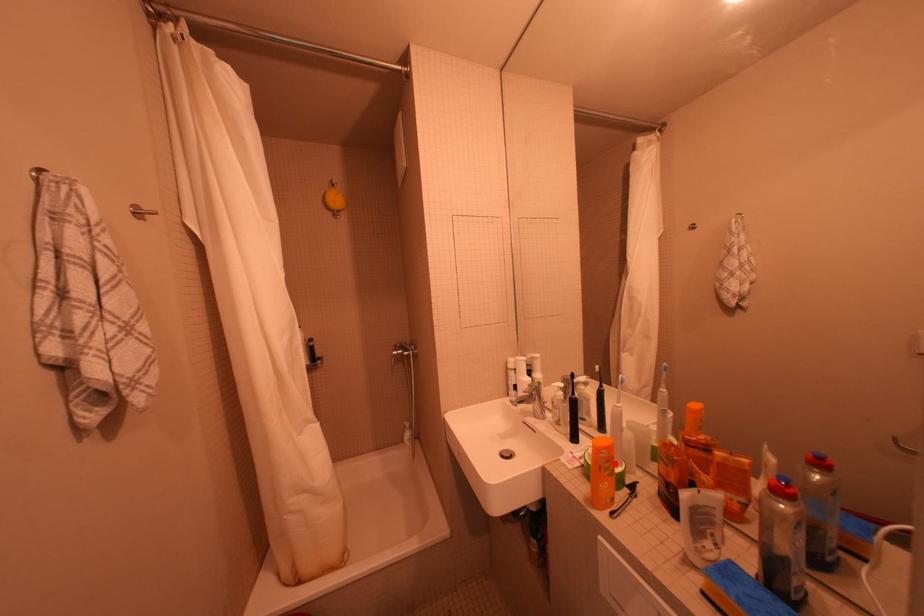
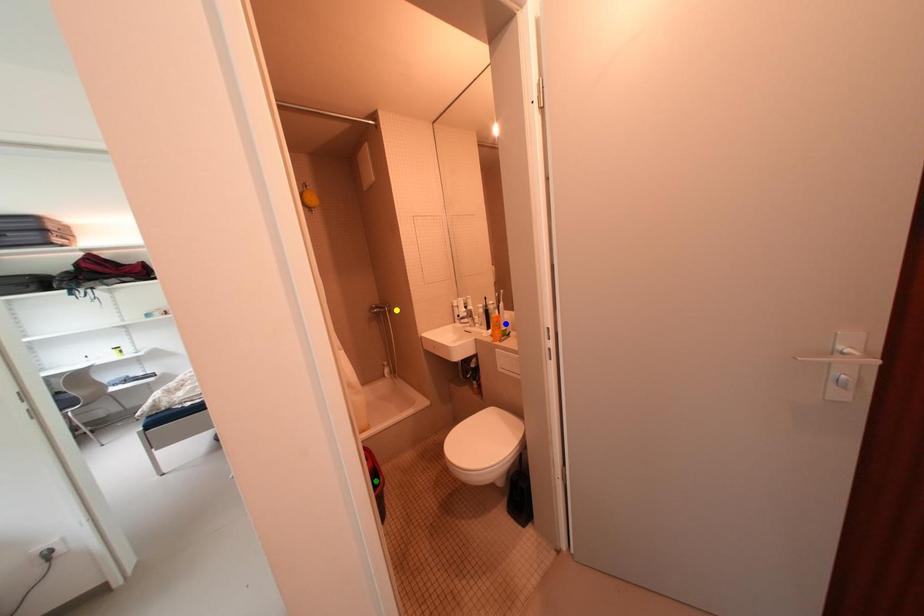
Question: I am providing you with two images of the same scene from different viewpoints. A red point is marked on the first image. You are given multiple points on the second image. Which point in image 2 represents the same 3d spot as the red point in image 1?

Choices:
 (A) blue point
 (B) yellow point
 (C) green point

Answer: (A)